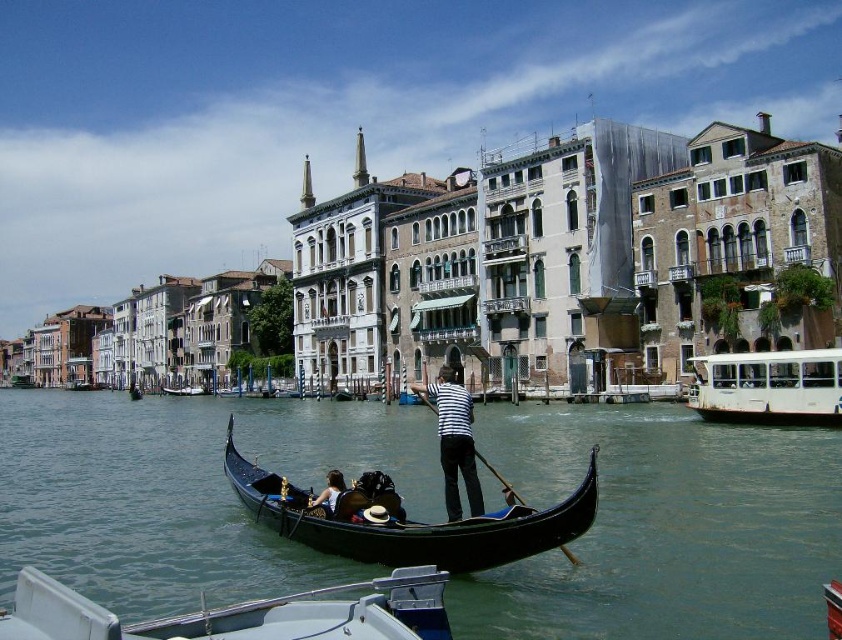
Question: Based on their relative distances, which object is nearer to the white plastic boat at lower center?

Choices:
 (A) striped fabric person at center
 (B) white matte boat at right
 (C) clear water at gondola center
 (D) black polished wood gondola at center

Answer: (D)

Question: Does white plastic boat at lower center appear on the left side of wooden gondola at center?

Choices:
 (A) no
 (B) yes

Answer: (A)

Question: Does white plastic boat at lower center have a larger size compared to black polished wood gondola at center?

Choices:
 (A) yes
 (B) no

Answer: (B)

Question: Does clear water at gondola center appear over light brown leather hat at center?

Choices:
 (A) no
 (B) yes

Answer: (A)

Question: Which point appears farthest from the camera in this image?

Choices:
 (A) (477, 532)
 (B) (705, 396)
 (C) (94, 627)
 (D) (196, 385)

Answer: (D)

Question: Considering the real-world distances, which object is farthest from the black polished wood gondola at center?

Choices:
 (A) wooden gondola at center
 (B) striped fabric person at center
 (C) light brown leather hat at center
 (D) white plastic boat at lower center

Answer: (A)